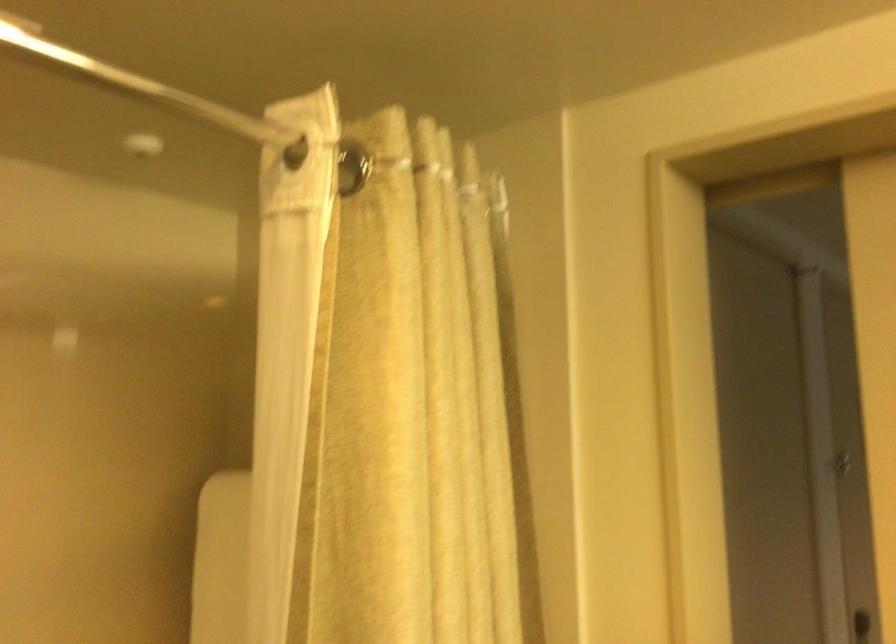
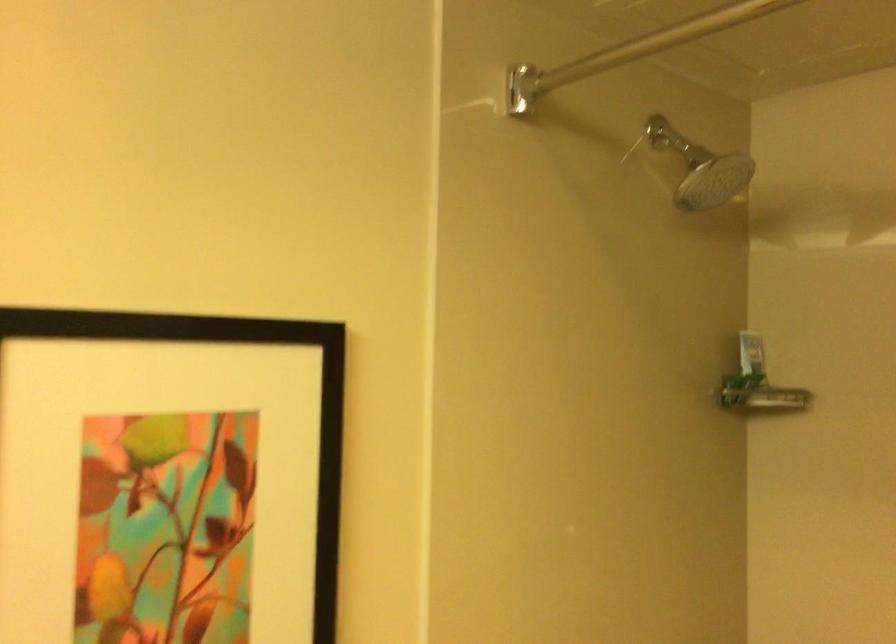
Question: Based on the continuous images, in which direction is the camera rotating? Reply with the corresponding letter.

Choices:
 (A) Left
 (B) Right
 (C) Up
 (D) Down

Answer: (A)